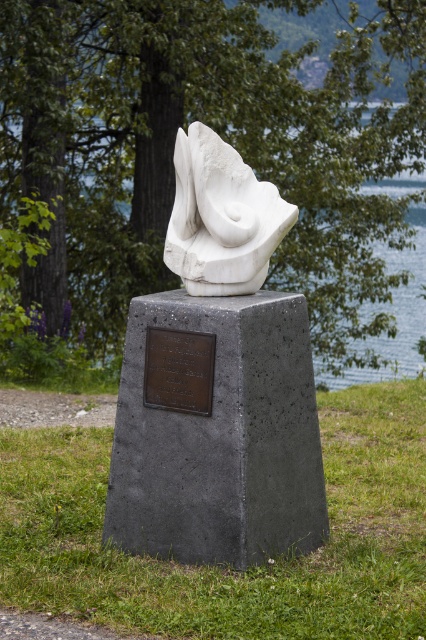
You are an artist planning to create a new sculpture installation near the existing one. You need to know the relative sizes of the objects to ensure proper spacing. Which object is narrower between the white marble bust at center and the blue water at center?

The white marble bust at center is thinner than the blue water at center, so the white marble bust at center is narrower.

You are an art student analyzing the sculpture. You notice the gray concrete pedestal at center and the bronze plaque at center. Which object is closer to you, the viewer?

The gray concrete pedestal at center is closer to the viewer than the bronze plaque at center, as it is positioned in front of it.

You are standing in front of the sculpture and want to take a photo of the white marble bust at center. If your camera has a maximum focus range of 4 meters, will you be able to capture it clearly?

The white marble bust at center is 4.40 meters away from the viewer. Since the camera can only focus up to 4 meters, it won not be able to capture the white marble bust at center clearly.